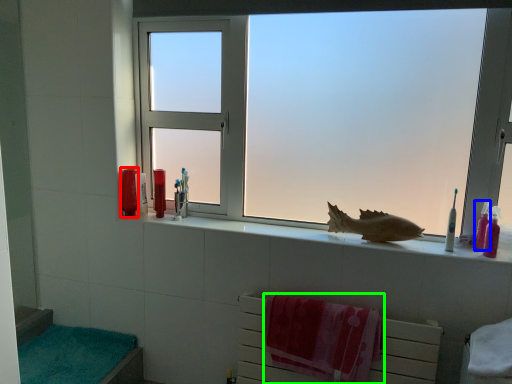
Question: Considering the real-world distances, which object is farthest from toiletry (highlighted by a red box)? toiletry (highlighted by a blue box) or beach towel (highlighted by a green box)?

Choices:
 (A) toiletry
 (B) beach towel

Answer: (A)